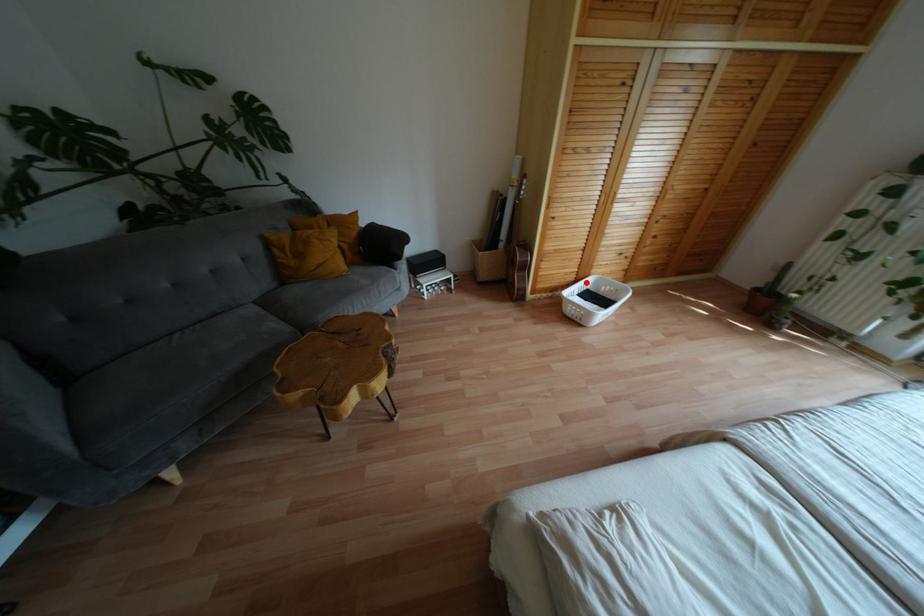
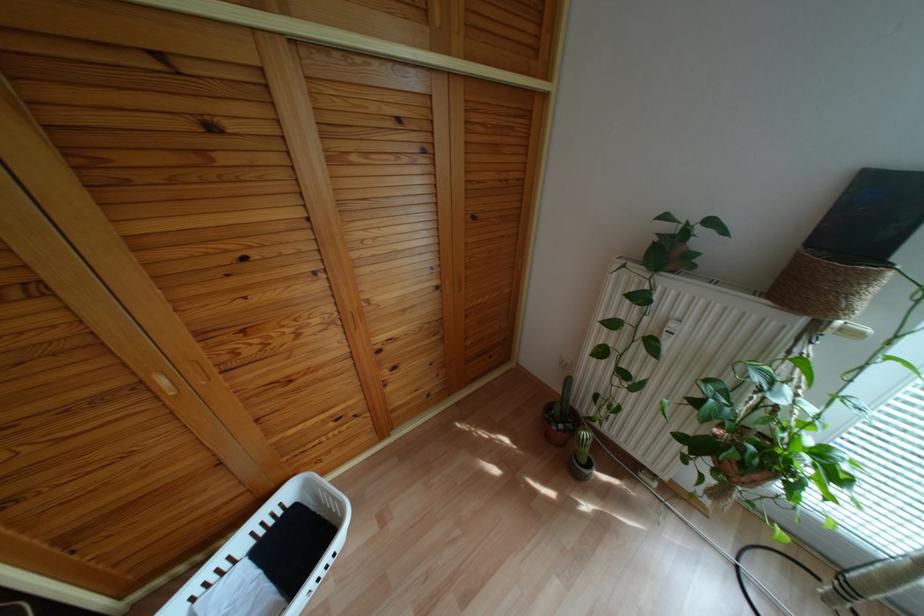
The point at the highlighted location is marked in the first image. Where is the corresponding point in the second image?

(287, 493)